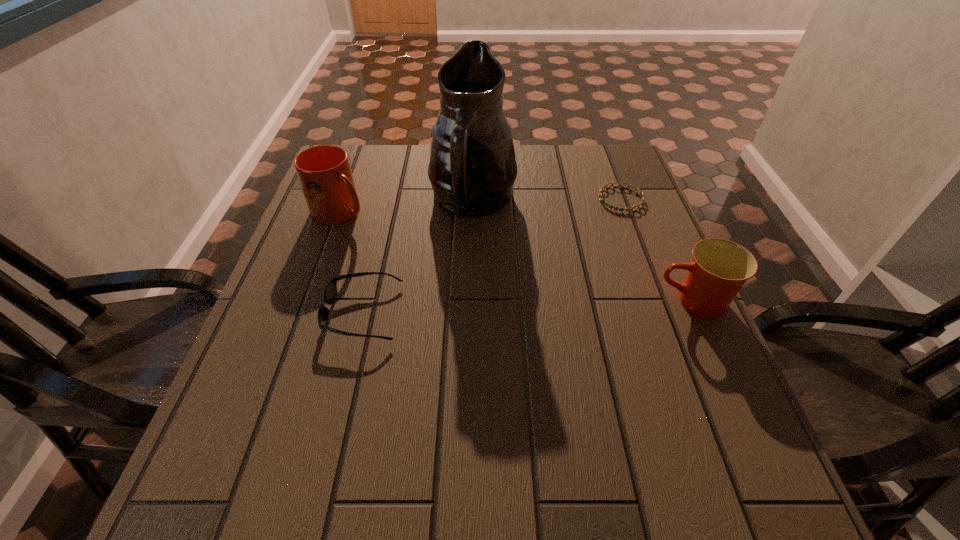
Locate which object ranks in proximity to the sunglasses. Please provide its 2D coordinates. Your answer should be formatted as a tuple, i.e. [(x, y)], where the tuple contains the x and y coordinates of a point satisfying the conditions above.

[(472, 169)]

The height and width of the screenshot is (540, 960). In order to click on free space that satisfies the following two spatial constraints: 1. on the front side of the sunglasses; 2. on the front-facing side of the second tallest object in this screenshot , I will do `click(304, 313)`.

Image resolution: width=960 pixels, height=540 pixels. In order to click on vacant area that satisfies the following two spatial constraints: 1. on the front side of the pitcher; 2. on the left side of the third tallest object in this screenshot , I will do `click(471, 302)`.